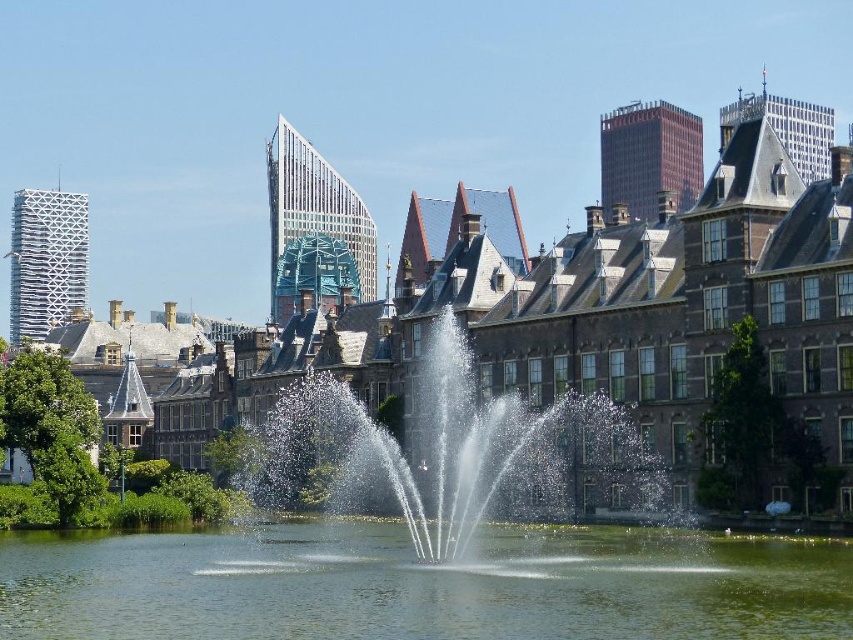
Does point (85, 547) come in front of point (492, 513)?

Yes, point (85, 547) is in front of point (492, 513).

Between clear water at center and clear water fountain at center, which one is positioned higher?

clear water fountain at center

Measure the distance between point (64, 563) and camera.

Point (64, 563) is 214.16 feet from camera.

At what (x,y) coordinates should I click in order to perform the action: click on clear water at center. Please return your answer as a coordinate pair (x, y). The image size is (853, 640). Looking at the image, I should click on (421, 586).